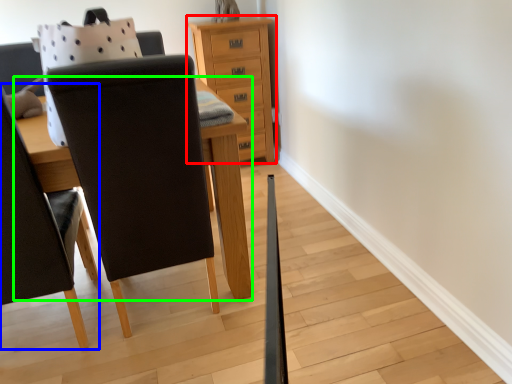
Question: Which object is the farthest from chest of drawers (highlighted by a red box)? Choose among these: chair (highlighted by a blue box) or table (highlighted by a green box).

Choices:
 (A) chair
 (B) table

Answer: (A)